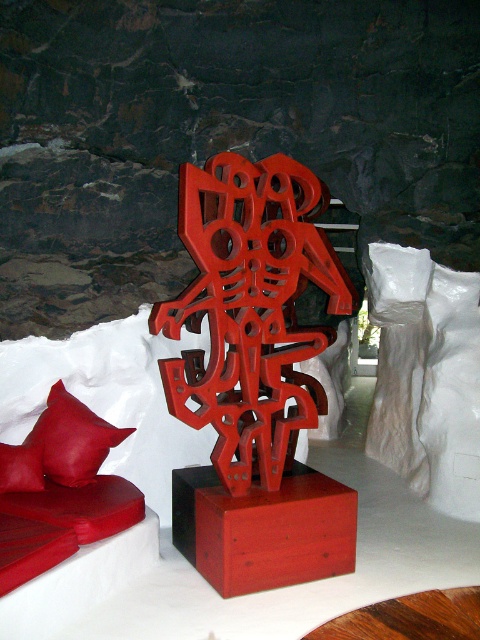
You are standing in front of the red abstract sculpture and want to walk from point A to point B. Point A is at coordinates point (x=276, y=493) and point B is at coordinates point (x=55, y=404). Which direction should you move relative to the sculpture to reach point B from point A?

To move from point (x=276, y=493) to point (x=55, y=404), you should move towards the lower left direction relative to the sculpture since point (x=276, y=493) is in front of point (x=55, y=404).

From the picture: You are standing in front of the sculpture and want to take a photo. You notice two points on the sculpture labeled as point (186, 304) and point (43, 476). Which point should you focus on first if you want to capture the closest part of the sculpture to your camera?

Point (186, 304) is closer to the camera than point (43, 476), so you should focus on point (186, 304) first to capture the closest part of the sculpture.

You are standing in front of the sculpture and want to place a book on the nearest object. Which object should you choose between the matte wood table at center and the matte leather pillow at lower left?

The matte wood table at center is to the right of the matte leather pillow at lower left, so the nearest object would depend on your exact position. However, since the table is centrally located and the pillow is at the lower left, the table is likely closer to the sculpture and thus closer to you. Therefore, you should place the book on the matte wood table at center.